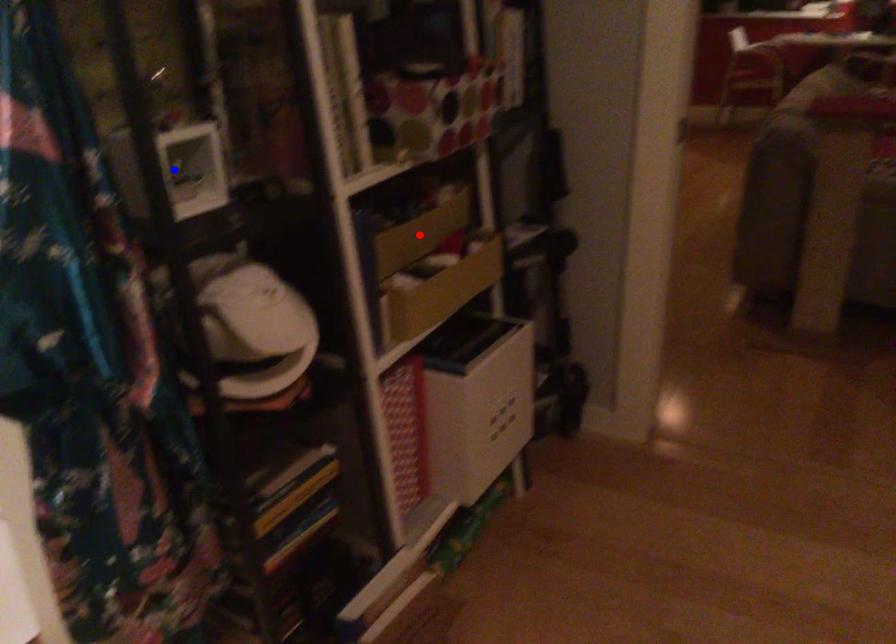
Question: In the image, two points are highlighted. Which point is nearer to the camera? Reply with the corresponding letter.

Choices:
 (A) blue point
 (B) red point

Answer: (A)